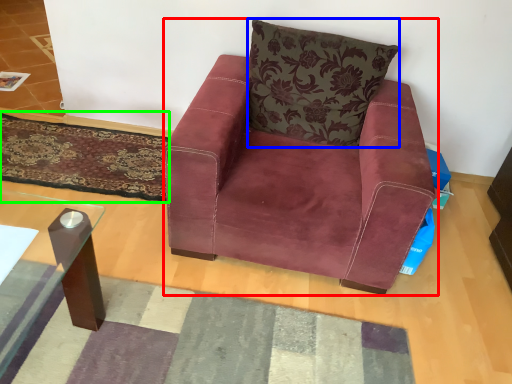
Question: Which is farther away from chair (highlighted by a red box)? pillow (highlighted by a blue box) or mat (highlighted by a green box)?

Choices:
 (A) pillow
 (B) mat

Answer: (B)